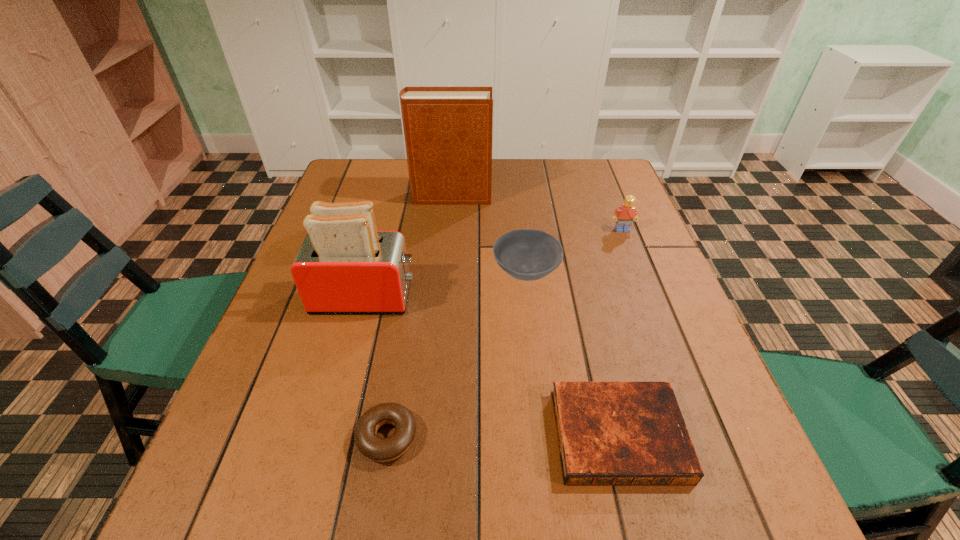
The height and width of the screenshot is (540, 960). What are the coordinates of `the farthest object` in the screenshot? It's located at (448, 130).

You are a GUI agent. You are given a task and a screenshot of the screen. Output one action in this format:
    pyautogui.click(x=<x>, y=<y>)
    Task: Click on the tallest object
    The width and height of the screenshot is (960, 540).
    Given the screenshot: What is the action you would take?
    pyautogui.click(x=448, y=130)

Locate an element on the screen. The height and width of the screenshot is (540, 960). the fifth shortest object is located at coordinates (344, 265).

In order to click on the fourth shortest object in this screenshot , I will do (627, 212).

I want to click on the fifth nearest object, so click(627, 212).

Where is `bowl`? The image size is (960, 540). bowl is located at coordinates (526, 254).

Where is `doughnut`? doughnut is located at coordinates (377, 449).

Image resolution: width=960 pixels, height=540 pixels. What are the coordinates of `Bible` in the screenshot? It's located at (609, 433).

Locate an element on the screen. This screenshot has height=540, width=960. vacant area situated 0.260m on the open cover of the hardback book is located at coordinates (578, 197).

Find the location of `vacant region located 0.180m on the front-facing side of the toaster`. vacant region located 0.180m on the front-facing side of the toaster is located at coordinates (494, 297).